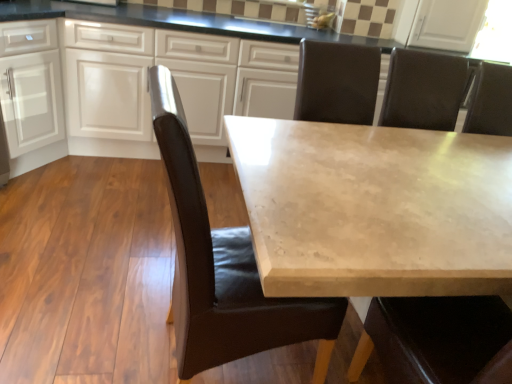
Question: From a real-world perspective, is white glossy cabinets at upper center, which is the 2th cabinetry in left-to-right order, positioned above or below beige marble table at center?

Choices:
 (A) above
 (B) below

Answer: (A)

Question: Is white glossy cabinets at upper center, which is the 2th cabinetry in left-to-right order, inside or outside of beige marble table at center?

Choices:
 (A) outside
 (B) inside

Answer: (A)

Question: Based on their relative distances, which object is nearer to the brown leather chair at center?

Choices:
 (A) beige marble table at center
 (B) white glossy cabinets at upper center, which is the 2th cabinetry in left-to-right order
 (C) white matte cabinet at left, the 1th cabinetry viewed from the left

Answer: (A)

Question: Which of these objects is positioned farthest from the brown leather chair at center?

Choices:
 (A) beige marble table at center
 (B) white glossy cabinets at upper center, which is counted as the 1th cabinetry, starting from the right
 (C) white matte cabinet at left, arranged as the 2th cabinetry when viewed from the right

Answer: (C)